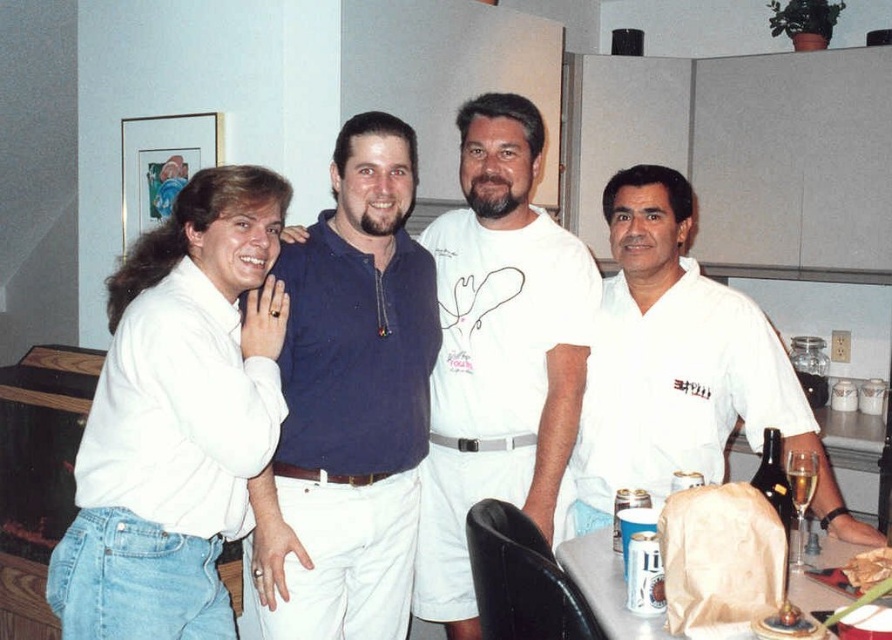
Can you confirm if white matte shirt at left is smaller than white cotton shirt at center?

Yes.

Is point (127, 369) less distant than point (684, 412)?

Yes, point (127, 369) is closer to viewer.

You are a GUI agent. You are given a task and a screenshot of the screen. Output one action in this format:
    pyautogui.click(x=<x>, y=<y>)
    Task: Click on the white matte shirt at left
    
    Given the screenshot: What is the action you would take?
    pyautogui.click(x=178, y=417)

Where is `white matte shirt at left`? This screenshot has width=892, height=640. white matte shirt at left is located at coordinates (178, 417).

Can you confirm if white matte shirt at left is positioned below white paper bag at lower center?

No.

Is white matte shirt at left positioned before white paper bag at lower center?

No, white matte shirt at left is behind white paper bag at lower center.

Find the location of a particular element. This screenshot has height=640, width=892. white matte shirt at left is located at coordinates (178, 417).

The height and width of the screenshot is (640, 892). What do you see at coordinates (500, 353) in the screenshot? I see `blue cotton polo shirt at center` at bounding box center [500, 353].

Which of these two, blue cotton polo shirt at center or white paper bag at lower center, stands shorter?

white paper bag at lower center

Which is behind, point (519, 275) or point (577, 563)?

Point (519, 275)

You are a GUI agent. You are given a task and a screenshot of the screen. Output one action in this format:
    pyautogui.click(x=<x>, y=<y>)
    Task: Click on the blue cotton polo shirt at center
    Image resolution: width=892 pixels, height=640 pixels.
    Given the screenshot: What is the action you would take?
    pyautogui.click(x=500, y=353)